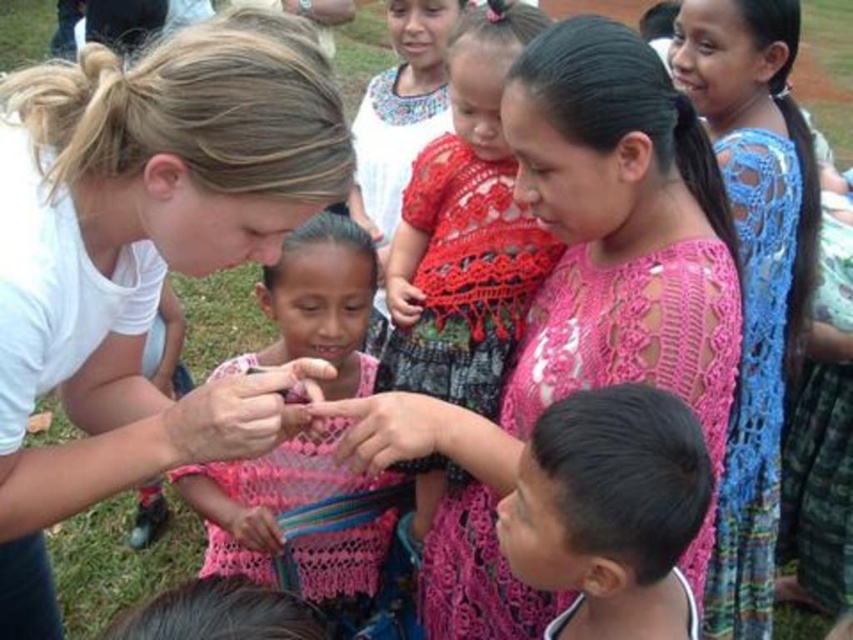
Can you confirm if white matte shirt at upper left is positioned above blue crochet dress at upper right?

No, white matte shirt at upper left is not above blue crochet dress at upper right.

Does white matte shirt at upper left appear on the right side of blue crochet dress at upper right?

In fact, white matte shirt at upper left is to the left of blue crochet dress at upper right.

Is point (120, 392) more distant than point (775, 291)?

No, (120, 392) is closer to viewer.

What are the coordinates of `white matte shirt at upper left` in the screenshot? It's located at (138, 262).

Does white matte shirt at upper left have a lesser width compared to red crochet dress at center?

In fact, white matte shirt at upper left might be wider than red crochet dress at center.

Where is `white matte shirt at upper left`? white matte shirt at upper left is located at coordinates (138, 262).

This screenshot has height=640, width=853. What do you see at coordinates (138, 262) in the screenshot?
I see `white matte shirt at upper left` at bounding box center [138, 262].

The image size is (853, 640). What are the coordinates of `white matte shirt at upper left` in the screenshot? It's located at (138, 262).

Between pink crochet dress at center and black lace hair at lower center, which one is positioned lower?

black lace hair at lower center is below.

Which is behind, point (695, 216) or point (639, 564)?

The point (695, 216) is behind.

Identify the location of pink crochet dress at center. The width and height of the screenshot is (853, 640). click(x=579, y=300).